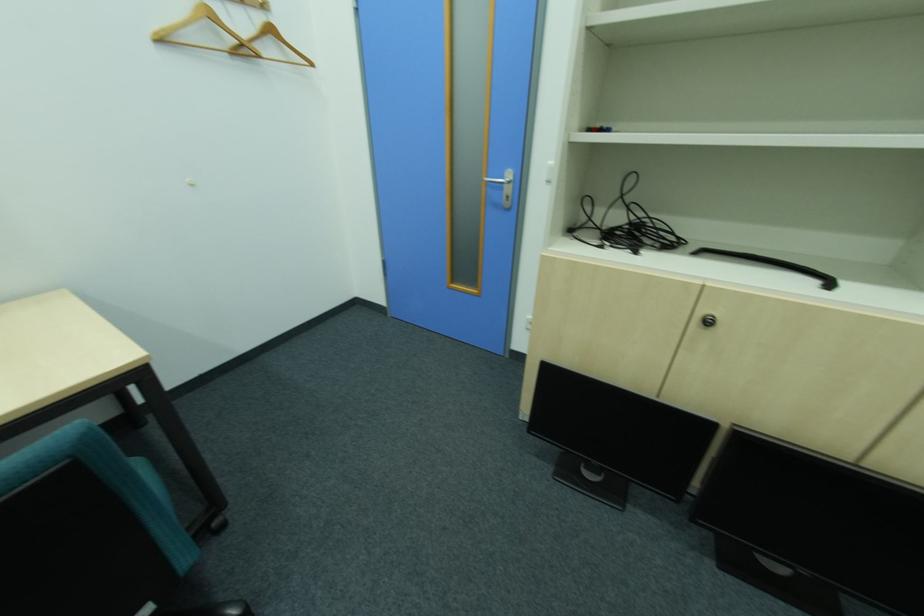
The height and width of the screenshot is (616, 924). What are the coordinates of `cabinet lock` in the screenshot? It's located at (708, 320).